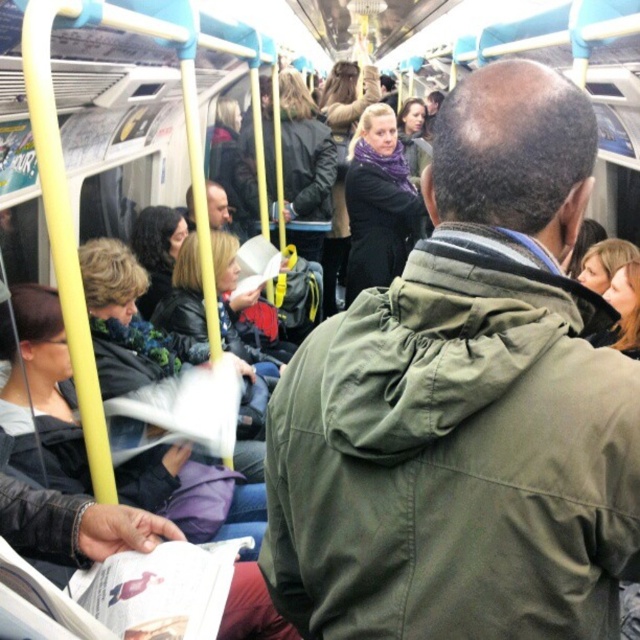
Question: Can you confirm if green matte jacket at center is positioned to the right of matte black jacket at center?

Choices:
 (A) yes
 (B) no

Answer: (A)

Question: Is green matte jacket at center positioned behind matte black jacket at center?

Choices:
 (A) yes
 (B) no

Answer: (B)

Question: Which point is closer to the camera taking this photo?

Choices:
 (A) tap(212, 200)
 (B) tap(314, 563)

Answer: (B)

Question: Is green matte jacket at center wider than matte black jacket at center?

Choices:
 (A) yes
 (B) no

Answer: (A)